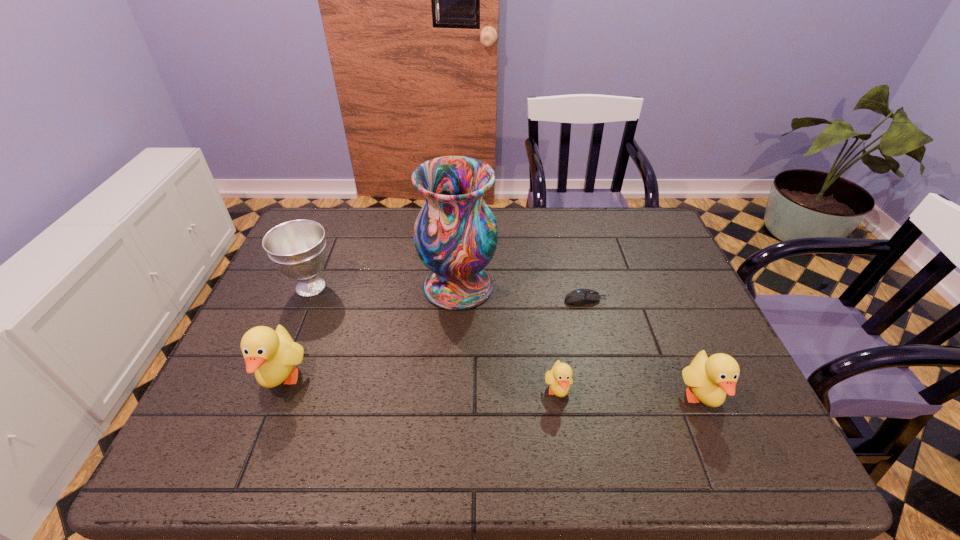
Where is `vacant space at the right edge of the desktop`? This screenshot has height=540, width=960. vacant space at the right edge of the desktop is located at coordinates (670, 279).

I want to click on vacant region at the far left corner, so click(353, 209).

The image size is (960, 540). In the image, there is a desktop. Find the location of `vacant area at the far right corner`. vacant area at the far right corner is located at coordinates (619, 210).

Locate an element on the screen. The image size is (960, 540). free region at the near right corner of the desktop is located at coordinates (677, 400).

Where is `vacant area that lies between the rightmost object and the leftmost duckling`? This screenshot has width=960, height=540. vacant area that lies between the rightmost object and the leftmost duckling is located at coordinates (492, 389).

Image resolution: width=960 pixels, height=540 pixels. Find the location of `free space between the vase and the rightmost object`. free space between the vase and the rightmost object is located at coordinates (580, 342).

Identify the location of vacant region between the fourth tallest object and the tallest object. This screenshot has width=960, height=540. (580, 342).

The width and height of the screenshot is (960, 540). Identify the location of empty space between the fourth object from left to right and the rightmost object. (630, 395).

The height and width of the screenshot is (540, 960). Find the location of `vacant area between the computer mouse and the shortest duckling`. vacant area between the computer mouse and the shortest duckling is located at coordinates (571, 346).

Find the location of `empty location between the second duckling from left to right and the fourth tallest object`. empty location between the second duckling from left to right and the fourth tallest object is located at coordinates (630, 395).